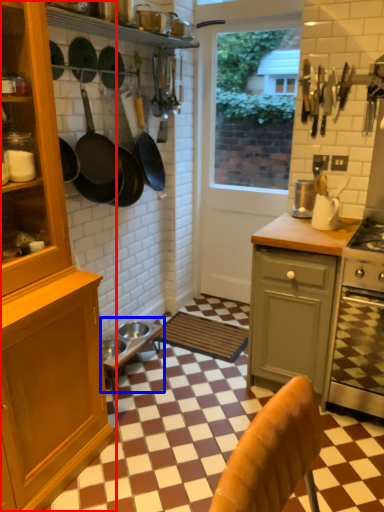
Question: Which object appears farthest to the camera in this image, cabinetry (highlighted by a red box) or table (highlighted by a blue box)?

Choices:
 (A) cabinetry
 (B) table

Answer: (B)